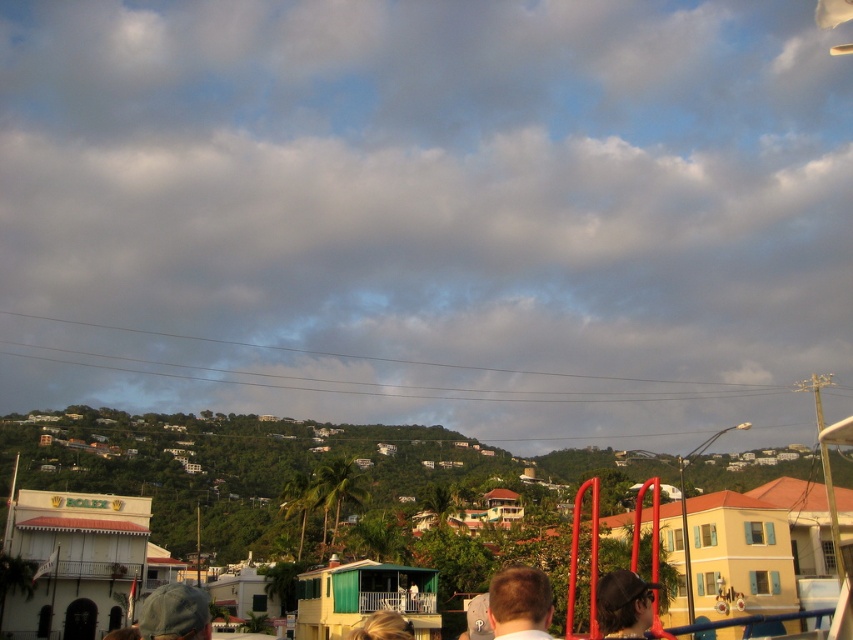
Question: Can you confirm if blonde hair at center is positioned above blonde hair at lower center?

Choices:
 (A) yes
 (B) no

Answer: (A)

Question: Which of the following is the farthest from the observer?

Choices:
 (A) camouflage fabric cap at lower left
 (B) matte black cap at center

Answer: (B)

Question: From the image, what is the correct spatial relationship of matte black cap at center in relation to blonde hair at lower center?

Choices:
 (A) below
 (B) above

Answer: (B)

Question: Which object is the farthest from the blonde hair at center?

Choices:
 (A) camouflage fabric cap at lower left
 (B) matte black cap at center
 (C) blonde hair at lower center

Answer: (A)

Question: Is matte black cap at center closer to the viewer compared to blonde hair at lower center?

Choices:
 (A) no
 (B) yes

Answer: (B)

Question: Based on their relative distances, which object is farther from the camouflage fabric cap at lower left?

Choices:
 (A) blonde hair at center
 (B) blonde hair at lower center

Answer: (B)